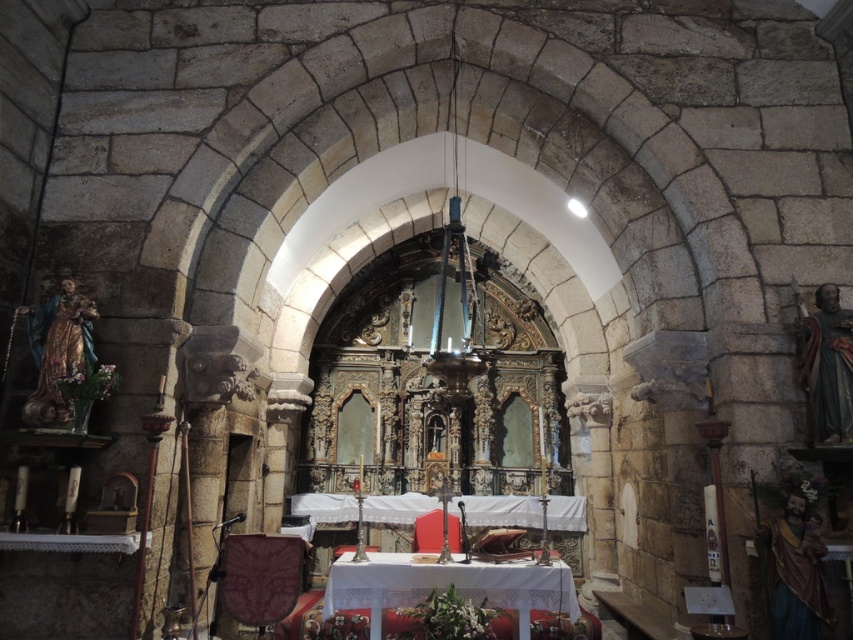
You are an interior designer planning to place a new table between the velvet purple chair at center and the velvet red chair at center. Given that the table requires 1 meter of space to fit comfortably, can the space between the two chairs accommodate it?

The velvet purple chair at center is wider than the velvet red chair at center. However, the description does not provide specific measurements of the distance between them. Without knowing the exact spacing, it is impossible to determine if the table will fit comfortably.

You are a visitor standing at the entrance of the church and want to sit in one of the chairs near the altar. The velvet purple chair at center and the velvet red chair at center are both available. If you want to choose the chair closer to the altar, which one should you pick?

Both the velvet purple chair at center and the velvet red chair at center are located at the same central position, so they are equally close to the altar. The distance between them is 3.24 meters, but their proximity to the altar is the same.